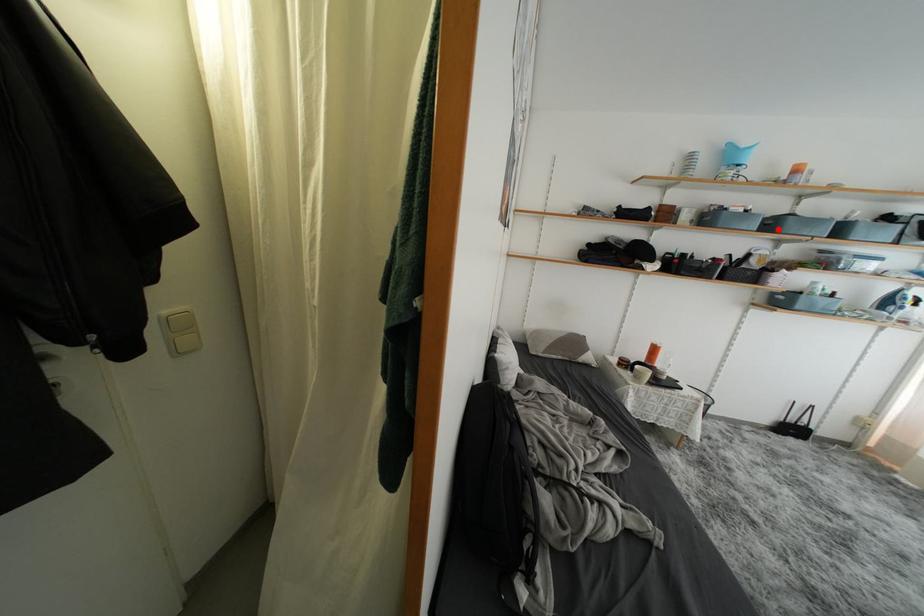
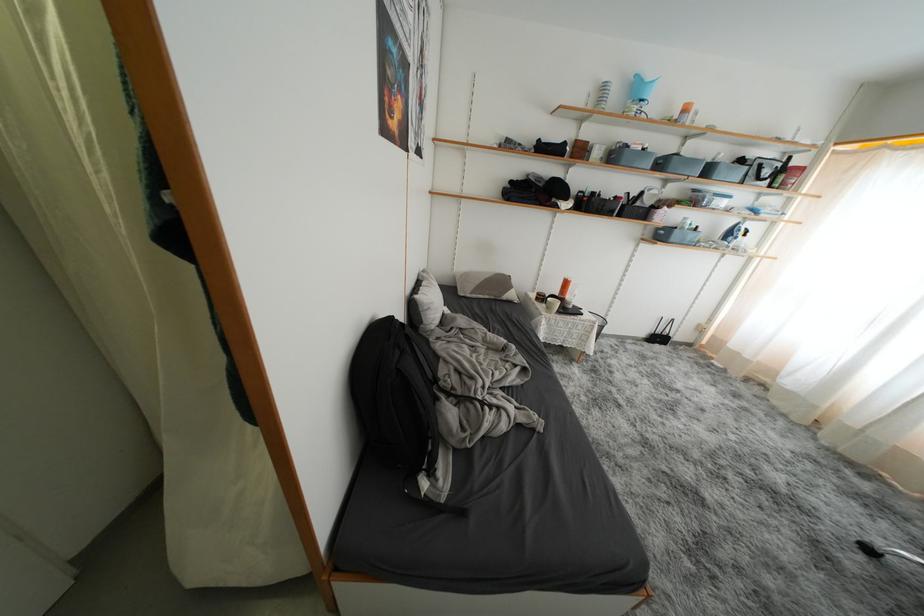
Find the pixel in the second image that matches the highlighted location in the first image.

(667, 168)